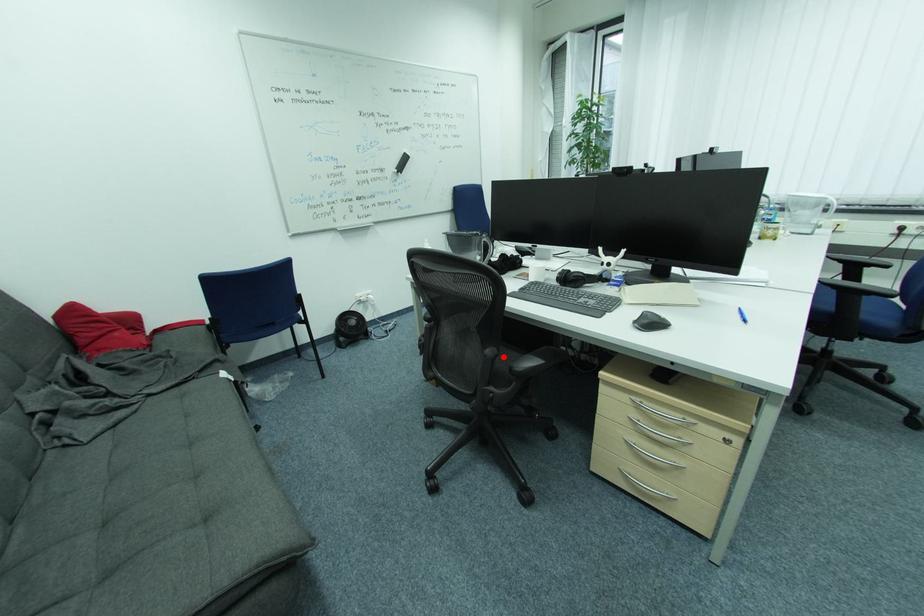
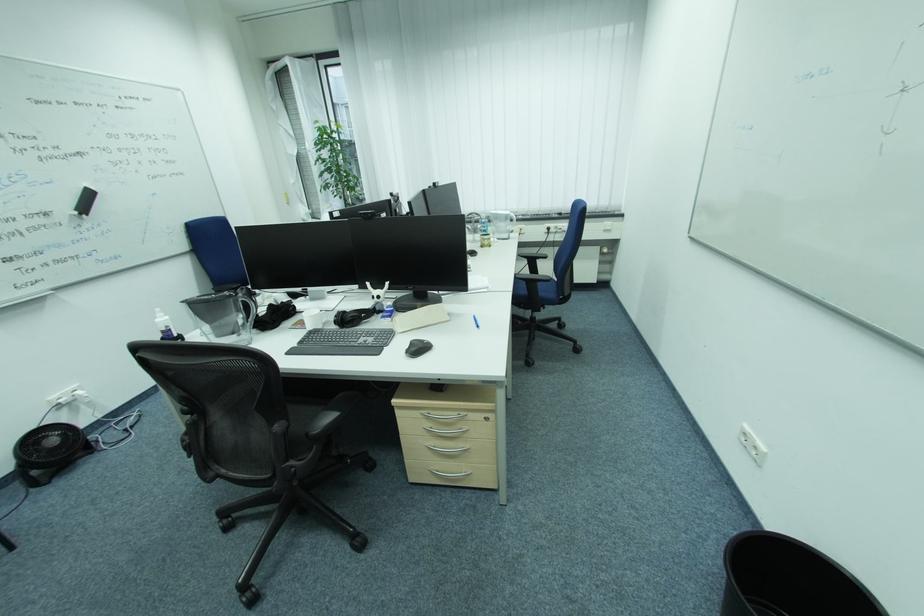
The point at the highlighted location is marked in the first image. Where is the corresponding point in the second image?

(294, 429)